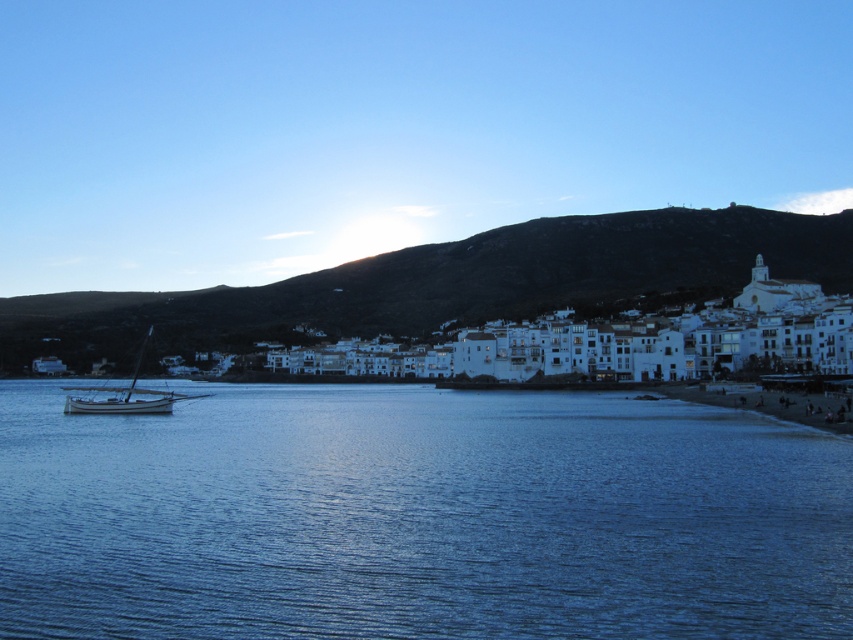
Which is above, blue water at center or wooden sailboat at left?

wooden sailboat at left

Is point (419, 524) behind point (67, 404)?

That is False.

Locate an element on the screen. blue water at center is located at coordinates (418, 516).

This screenshot has width=853, height=640. What do you see at coordinates (450, 284) in the screenshot?
I see `dark green hillside at upper center` at bounding box center [450, 284].

Who is positioned more to the left, dark green hillside at upper center or wooden sailboat at left?

wooden sailboat at left

Which is in front, point (90, 332) or point (146, 406)?

Point (146, 406) is in front.

Find the location of a particular element. This screenshot has width=853, height=640. dark green hillside at upper center is located at coordinates (450, 284).

Can you confirm if blue water at center is positioned to the right of dark green hillside at upper center?

Correct, you'll find blue water at center to the right of dark green hillside at upper center.

Does blue water at center appear over dark green hillside at upper center?

Incorrect, blue water at center is not positioned above dark green hillside at upper center.

The height and width of the screenshot is (640, 853). Describe the element at coordinates (418, 516) in the screenshot. I see `blue water at center` at that location.

Locate an element on the screen. The width and height of the screenshot is (853, 640). blue water at center is located at coordinates (418, 516).